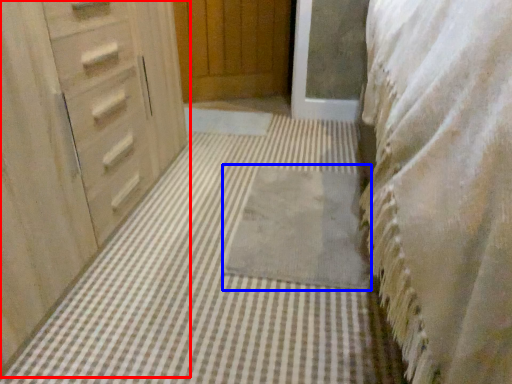
Question: Which of the following is the closest to the observer, chest of drawers (highlighted by a red box) or bath mat (highlighted by a blue box)?

Choices:
 (A) chest of drawers
 (B) bath mat

Answer: (A)